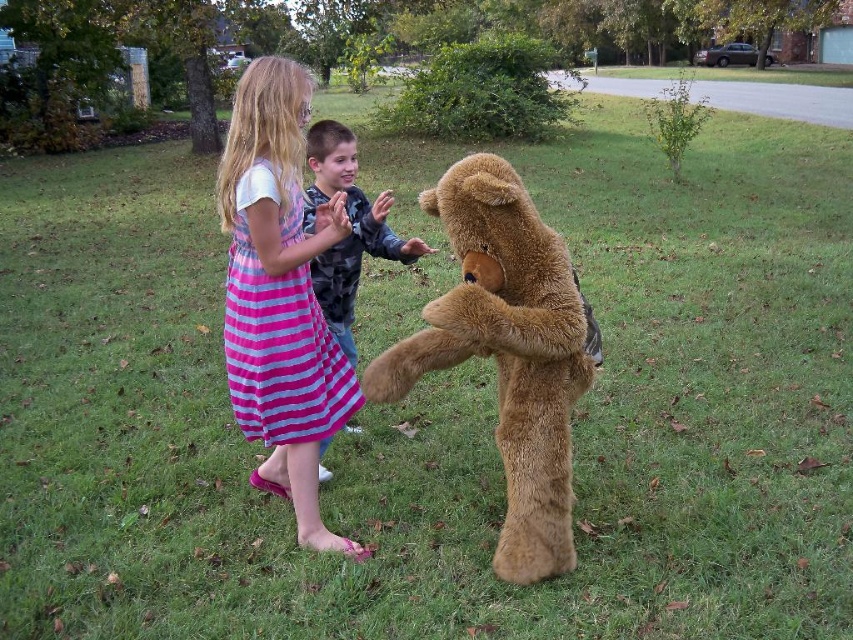
Looking at this image, which is more to the right, fuzzy brown teddy bear at center or camouflage jacket at center?

Positioned to the right is fuzzy brown teddy bear at center.

Does fuzzy brown teddy bear at center appear over camouflage jacket at center?

Actually, fuzzy brown teddy bear at center is below camouflage jacket at center.

Who is more forward, (508, 220) or (346, 275)?

Point (508, 220) is in front.

I want to click on fuzzy brown teddy bear at center, so click(508, 352).

How distant is fuzzy brown teddy bear at center from pink striped dress at center?

They are 24.12 inches apart.

Which is behind, point (547, 237) or point (236, 228)?

The point (236, 228) is behind.

Where is `fuzzy brown teddy bear at center`? The height and width of the screenshot is (640, 853). fuzzy brown teddy bear at center is located at coordinates [x=508, y=352].

Can you confirm if pink striped dress at center is taller than camouflage jacket at center?

Correct, pink striped dress at center is much taller as camouflage jacket at center.

Between pink striped dress at center and camouflage jacket at center, which one appears on the left side from the viewer's perspective?

pink striped dress at center

Does point (289, 237) lie in front of point (370, 236)?

Yes, it is.

Locate an element on the screen. pink striped dress at center is located at coordinates (280, 294).